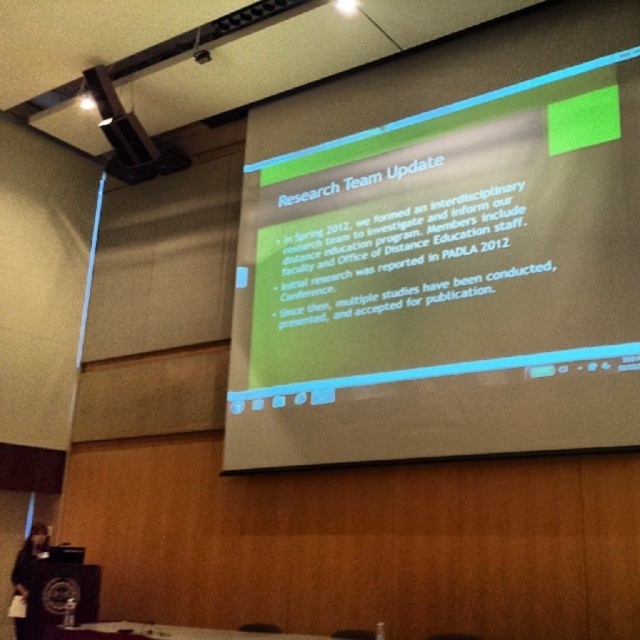
You are setting up a camera to capture both the green matte projector screen at upper center and the white glossy table at lower center for a video call. Which object should you position the camera closer to ensure both are in frame?

The green matte projector screen at upper center is taller than the white glossy table at lower center. To capture both in frame, position the camera closer to the white glossy table at lower center so that the height difference is accommodated within the camera view.

You are a presenter standing at the front of the room facing the green matte projector screen at upper center. If you want to point to the slide title located at the top of the screen, should you move your hand upward or downward from the center of the screen?

You should move your hand upward from the center of the green matte projector screen at upper center because the slide title is located at the top of the screen.